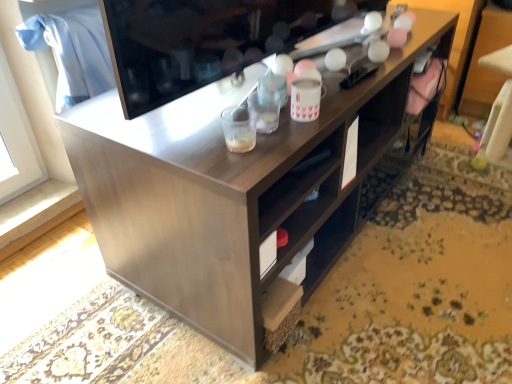
The width and height of the screenshot is (512, 384). What are the coordinates of `free space between translucent plastic cup at center, the second beverage when ordered from back to front, and white ceramic mug at upper center, which appears as the second beverage when viewed from the left` in the screenshot? It's located at (285, 129).